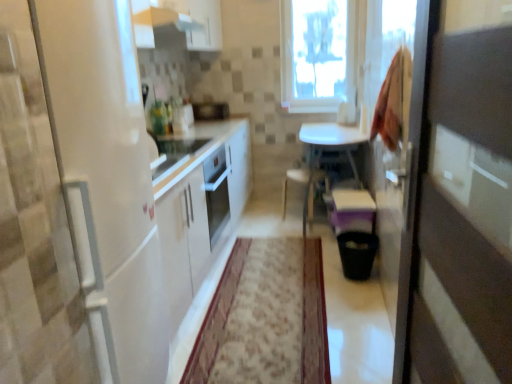
What are the coordinates of `blank area beneath carpet with floral pattern at center (from a real-world perspective)` in the screenshot? It's located at (273, 295).